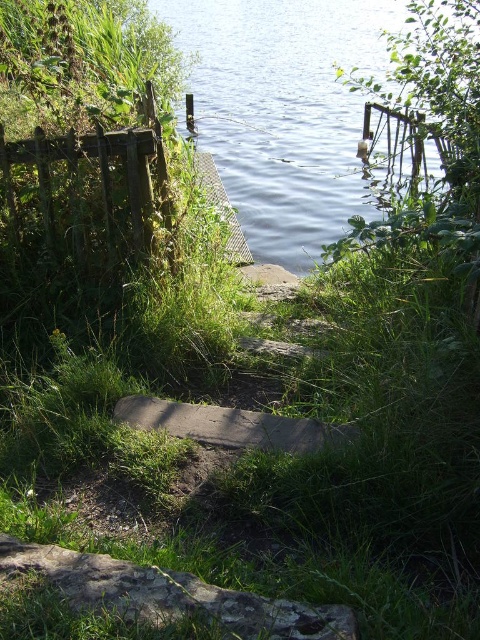
Question: Does blue water at upper center appear over brown stone path at center?

Choices:
 (A) no
 (B) yes

Answer: (B)

Question: Can you confirm if blue water at upper center is wider than brown stone path at center?

Choices:
 (A) no
 (B) yes

Answer: (B)

Question: Is blue water at upper center further to the viewer compared to brown stone path at center?

Choices:
 (A) yes
 (B) no

Answer: (A)

Question: Among these objects, which one is nearest to the camera?

Choices:
 (A) blue water at upper center
 (B) brown stone path at center

Answer: (B)